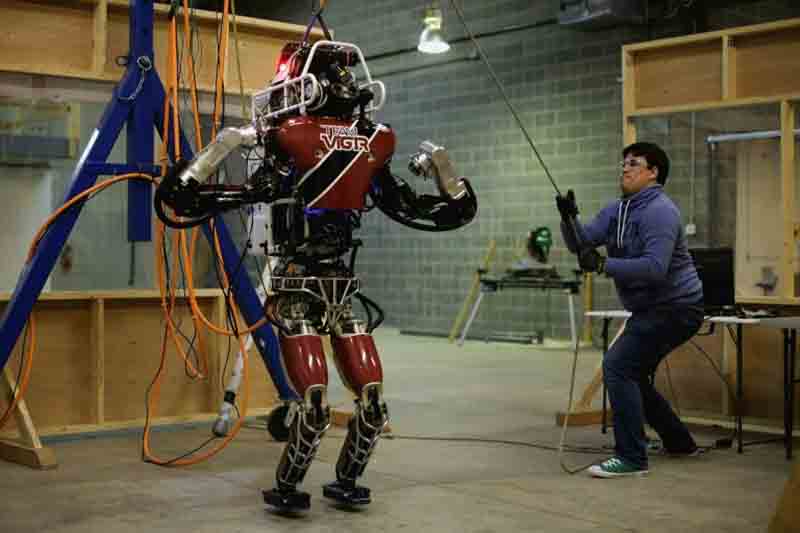
This screenshot has height=533, width=800. Identify the location of wires. (464, 440), (710, 362), (166, 338), (218, 320), (242, 379), (104, 181), (166, 85), (192, 67), (222, 56), (238, 70).